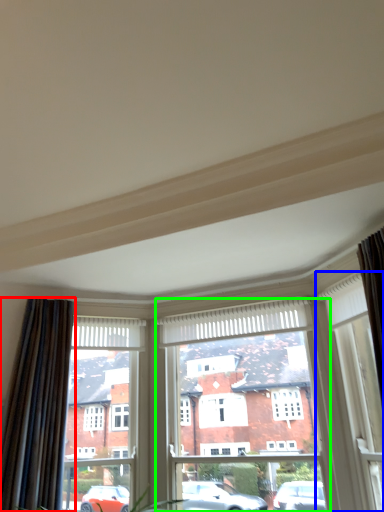
Question: Based on their relative distances, which object is nearer to curtain (highlighted by a red box)? Choose from window (highlighted by a blue box) and window frame (highlighted by a green box).

Choices:
 (A) window
 (B) window frame

Answer: (B)